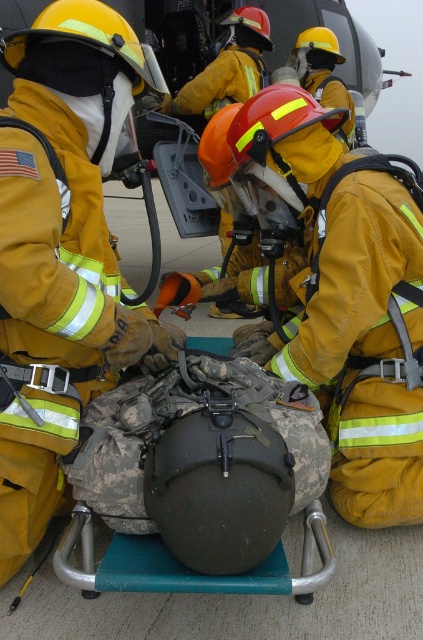
In the scene shown: You are a firefighter in the scene and need to quickly grab an item to shield yourself from a sudden heat source. Which item, the yellow reflective uniform at center or the camouflage helmet at center, would you choose based on their size?

The yellow reflective uniform at center is thinner than the camouflage helmet at center, so the camouflage helmet at center would provide better protection due to its larger size.

Looking at this image, you are a firefighter in the scene and need to move from your current position to the point at the back. Which of the two points, point (368,296) or point (206,67), should you move towards?

You should move towards point (206,67) because point (368,296) is in front of point (206,67), meaning point (206,67) is further back.

You are a firefighter in the scene and need to locate your equipment. Which item is closer to you, the yellow reflective uniform at center or the yellow reflective helmet at center?

The yellow reflective uniform at center is closer to you because it is in front of the yellow reflective helmet at center.